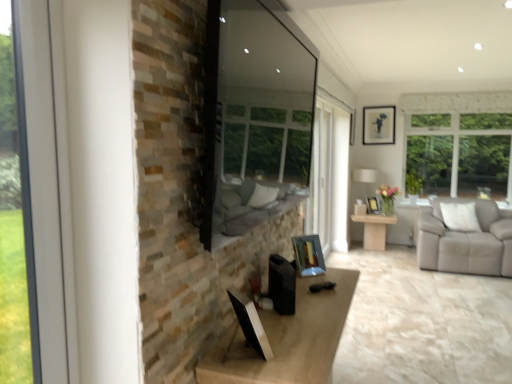
Identify the location of white fabric lampshade at right. (364, 175).

At what (x,y) coordinates should I click in order to perform the action: click on metallic silver picture frame at center-right, positioned as the 2th picture frame in back-to-front order. Please return your answer as a coordinate pair (x, y). This screenshot has height=384, width=512. Looking at the image, I should click on (373, 205).

Find the location of a particular element. The width and height of the screenshot is (512, 384). light wood table at center is located at coordinates (374, 229).

In order to face metallic silver picture frame at upper right, the third picture frame positioned from the left, should I rotate leftwards or rightwards?

Rotate right and turn 16.242 degrees.

Locate an element on the screen. The height and width of the screenshot is (384, 512). transparent glass window screen at center is located at coordinates (255, 116).

From the image's perspective, is clear glass window at left below light wood table at center?

Incorrect, from the image's perspective, clear glass window at left is higher than light wood table at center.

Is clear glass window at left inside or outside of light wood table at center?

clear glass window at left exists outside the volume of light wood table at center.

Locate an element on the screen. Image resolution: width=512 pixels, height=384 pixels. window that is above the light wood table at center (from a real-world perspective) is located at coordinates (30, 203).

From a real-world perspective, is clear glass window at left positioned under light wood table at center based on gravity?

No, from a real-world perspective, clear glass window at left is not under light wood table at center.

How many degrees apart are the facing directions of transparent glass window screen at center and metallic silver picture frame at center-right, the second picture frame from the top?

transparent glass window screen at center and metallic silver picture frame at center-right, the second picture frame from the top, are facing 56.7 degrees away from each other.

Is transparent glass window screen at center outside of metallic silver picture frame at center-right, which is the second picture frame from front to back?

transparent glass window screen at center lies outside metallic silver picture frame at center-right, which is the second picture frame from front to back,'s area.

From a real-world perspective, count 2nd picture frames downward from the transparent glass window screen at center and point to it. Please provide its 2D coordinates.

[(373, 205)]

Which is more to the right, transparent glass window screen at center or metallic silver picture frame at center-right, positioned as the 2th picture frame in back-to-front order?

metallic silver picture frame at center-right, positioned as the 2th picture frame in back-to-front order, is more to the right.

Is metallic silver picture frame at upper right, which is the third picture frame from bottom to top, not inside metallic silver picture frame at center-right, which is the 2th picture frame in left-to-right order?

metallic silver picture frame at upper right, which is the third picture frame from bottom to top, lies outside metallic silver picture frame at center-right, which is the 2th picture frame in left-to-right order,'s area.

From a real-world perspective, is metallic silver picture frame at upper right, the first picture frame positioned from the top, on metallic silver picture frame at center-right, which is the 2th picture frame in left-to-right order?

Yes.

Is metallic silver picture frame at center-right, which is the second picture frame from front to back, at the back of metallic silver picture frame at upper right, positioned as the 3th picture frame in front-to-back order?

That's not correct — metallic silver picture frame at upper right, positioned as the 3th picture frame in front-to-back order, is not looking away from metallic silver picture frame at center-right, which is the second picture frame from front to back.

From the image's perspective, is metallic silver picture frame at upper right, the third picture frame positioned from the left, located above or below metallic silver picture frame at center-right, the second picture frame from the top?

Based on their image positions, metallic silver picture frame at upper right, the third picture frame positioned from the left, is located above metallic silver picture frame at center-right, the second picture frame from the top.

Is clear glass window at left bigger than metallic silver picture frame at center-right, the 2th picture frame from the bottom?

Yes, clear glass window at left is bigger than metallic silver picture frame at center-right, the 2th picture frame from the bottom.

From a real-world perspective, who is located higher, clear glass window at left or metallic silver picture frame at center-right, acting as the second picture frame starting from the right?

From a 3D spatial view, clear glass window at left is above.

Considering the sizes of clear glass window at left and metallic silver picture frame at center-right, which is the second picture frame from front to back, in the image, is clear glass window at left taller or shorter than metallic silver picture frame at center-right, which is the second picture frame from front to back,?

Considering their sizes, clear glass window at left has more height than metallic silver picture frame at center-right, which is the second picture frame from front to back.

From a real-world perspective, between metallic silver picture frame at upper right, positioned as the 1th picture frame in right-to-left order, and white fabric lampshade at right, who is vertically lower?

white fabric lampshade at right is physically lower.

Which object is further away from the camera, metallic silver picture frame at upper right, the first picture frame positioned from the top, or white fabric lampshade at right?

metallic silver picture frame at upper right, the first picture frame positioned from the top.

Which object is positioned more to the left, metallic silver picture frame at upper right, which is the third picture frame from bottom to top, or white fabric lampshade at right?

Positioned to the left is white fabric lampshade at right.

Is clear glass window at left inside the boundaries of metallic silver picture frame at center, the 3th picture frame positioned from the right, or outside?

clear glass window at left is located beyond the bounds of metallic silver picture frame at center, the 3th picture frame positioned from the right.

Which is behind, point (44, 294) or point (315, 238)?

The point (315, 238) is behind.

Is clear glass window at left to the right of metallic silver picture frame at center, which is counted as the first picture frame, starting from the left, from the viewer's perspective?

In fact, clear glass window at left is to the left of metallic silver picture frame at center, which is counted as the first picture frame, starting from the left.

Can you confirm if clear glass window at left is wider than metallic silver picture frame at center, marked as the third picture frame in a back-to-front arrangement?

In fact, clear glass window at left might be narrower than metallic silver picture frame at center, marked as the third picture frame in a back-to-front arrangement.

How different are the orientations of transparent glass window screen at center and metallic silver picture frame at center, which is counted as the first picture frame, starting from the bottom, in degrees?

There is a 46.5-degree angle between the facing directions of transparent glass window screen at center and metallic silver picture frame at center, which is counted as the first picture frame, starting from the bottom.

Which is nearer, (241, 181) or (300, 255)?

The point (300, 255) is closer to the camera.

Does transparent glass window screen at center come in front of metallic silver picture frame at center, the 3th picture frame positioned from the right?

Yes.

You are a GUI agent. You are given a task and a screenshot of the screen. Output one action in this format:
    pyautogui.click(x=<x>, y=<y>)
    Task: Click on the table below the clear glass window at left (from the image's perspective)
    
    Given the screenshot: What is the action you would take?
    pyautogui.click(x=374, y=229)

You are a GUI agent. You are given a task and a screenshot of the screen. Output one action in this format:
    pyautogui.click(x=<x>, y=<y>)
    Task: Click on the window screen located in front of the metallic silver picture frame at center-right, acting as the second picture frame starting from the right
    The height and width of the screenshot is (384, 512).
    Given the screenshot: What is the action you would take?
    pyautogui.click(x=255, y=116)

Looking at the image, which one is located closer to white fabric lampshade at right, light wood table at center or clear glass window at left?

Based on the image, light wood table at center appears to be nearer to white fabric lampshade at right.

Looking at the image, which one is located closer to metallic silver picture frame at center-right, positioned as the 2th picture frame in back-to-front order, metallic silver picture frame at center, arranged as the third picture frame when viewed from the top, or light wood table at center?

Based on the image, light wood table at center appears to be nearer to metallic silver picture frame at center-right, positioned as the 2th picture frame in back-to-front order.

Considering their positions, is metallic silver picture frame at upper right, arranged as the 1th picture frame when viewed from the back, positioned closer to metallic silver picture frame at center-right, acting as the second picture frame starting from the right, than white fabric lampshade at right?

Based on the image, white fabric lampshade at right appears to be nearer to metallic silver picture frame at center-right, acting as the second picture frame starting from the right.

Based on their spatial positions, is transparent glass window screen at center or metallic silver picture frame at upper right, which is the third picture frame from bottom to top, further from light wood table at center?

Based on the image, transparent glass window screen at center appears to be further to light wood table at center.

Looking at the image, which one is located further to white fabric lampshade at right, light wood table at center or metallic silver picture frame at center, marked as the third picture frame in a back-to-front arrangement?

metallic silver picture frame at center, marked as the third picture frame in a back-to-front arrangement, is further to white fabric lampshade at right.

Which object lies further to the anchor point clear glass window at left, light wood table at center or transparent glass window screen at center?

light wood table at center is positioned further to the anchor clear glass window at left.

From the image, which object appears to be farther from metallic silver picture frame at upper right, positioned as the 1th picture frame in right-to-left order, light wood table at center or transparent glass window screen at center?

The object further to metallic silver picture frame at upper right, positioned as the 1th picture frame in right-to-left order, is transparent glass window screen at center.

Estimate the real-world distances between objects in this image. Which object is further from metallic silver picture frame at center, marked as the first picture frame in a front-to-back arrangement, clear glass window at left or white fabric lampshade at right?

white fabric lampshade at right is positioned further to the anchor metallic silver picture frame at center, marked as the first picture frame in a front-to-back arrangement.

You are a GUI agent. You are given a task and a screenshot of the screen. Output one action in this format:
    pyautogui.click(x=<x>, y=<y>)
    Task: Click on the table between transparent glass window screen at center and metallic silver picture frame at upper right, which is the third picture frame from bottom to top, from front to back
    This screenshot has height=384, width=512.
    Given the screenshot: What is the action you would take?
    pyautogui.click(x=374, y=229)

Find the location of a particular element. This screenshot has width=512, height=384. lamp between metallic silver picture frame at center, marked as the third picture frame in a back-to-front arrangement, and metallic silver picture frame at upper right, positioned as the 1th picture frame in right-to-left order, from front to back is located at coordinates (364, 175).

You are a GUI agent. You are given a task and a screenshot of the screen. Output one action in this format:
    pyautogui.click(x=<x>, y=<y>)
    Task: Click on the window screen between clear glass window at left and metallic silver picture frame at center-right, acting as the second picture frame starting from the right, in the front-back direction
    The width and height of the screenshot is (512, 384).
    Given the screenshot: What is the action you would take?
    pyautogui.click(x=255, y=116)

What are the coordinates of `lamp that lies between metallic silver picture frame at upper right, positioned as the 3th picture frame in front-to-back order, and metallic silver picture frame at center-right, positioned as the 2th picture frame in back-to-front order, from top to bottom` in the screenshot? It's located at (364, 175).